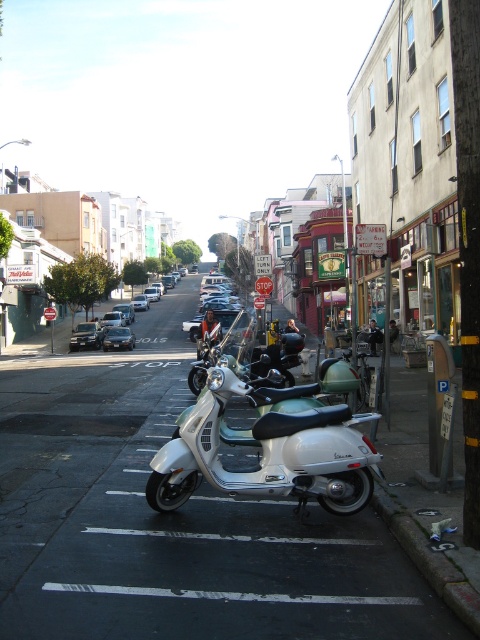
Does white metallic scooter at center appear under shiny silver car at center?

Indeed, white metallic scooter at center is positioned under shiny silver car at center.

Who is lower down, white metallic scooter at center or shiny silver car at center?

Positioned lower is white metallic scooter at center.

The image size is (480, 640). What are the coordinates of `white metallic scooter at center` in the screenshot? It's located at (267, 452).

Is white glossy line at lower center in front of shiny silver car at center?

Yes, it is in front of shiny silver car at center.

Who is positioned more to the left, white glossy line at lower center or shiny silver car at center?

From the viewer's perspective, shiny silver car at center appears more on the left side.

Identify the location of white glossy line at lower center. The image size is (480, 640). (231, 536).

Can you confirm if white painted line at lower center is smaller than matte black sedan at left?

Yes, white painted line at lower center is smaller than matte black sedan at left.

Does white painted line at lower center appear under matte black sedan at left?

Correct, white painted line at lower center is located below matte black sedan at left.

Between point (400, 600) and point (100, 342), which one is positioned in front?

Point (400, 600)

Locate an element on the screen. This screenshot has height=640, width=480. white painted line at lower center is located at coordinates (229, 595).